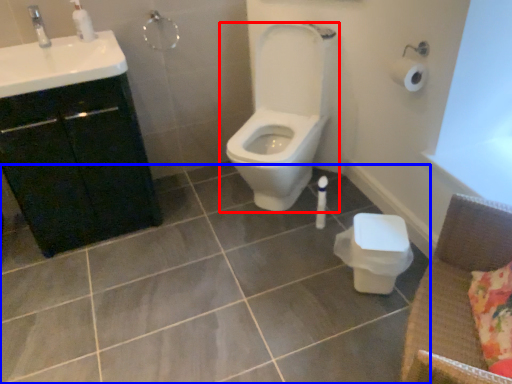
Question: Which of the following is the closest to the observer, toilet (highlighted by a red box) or ceramic tile (highlighted by a blue box)?

Choices:
 (A) toilet
 (B) ceramic tile

Answer: (B)